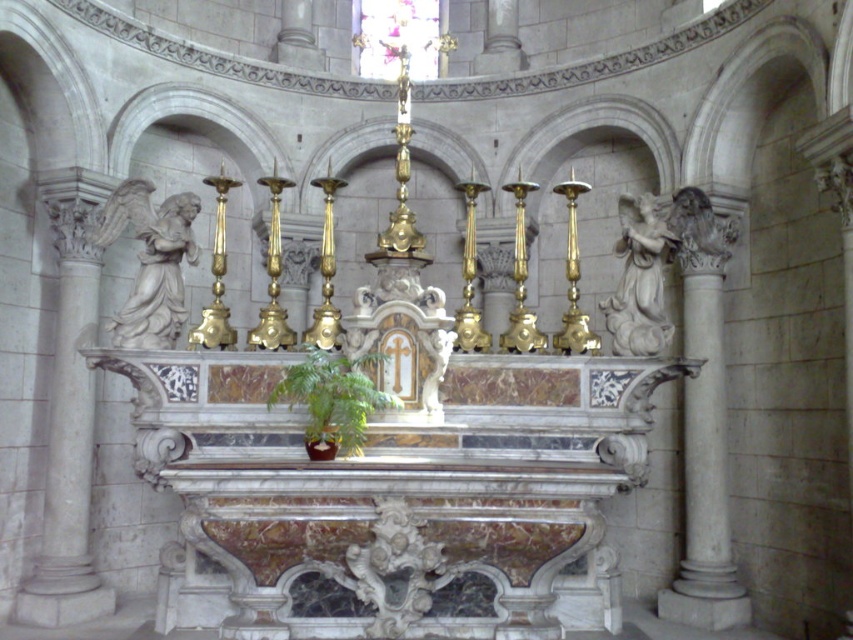
From the picture: You are standing in front of the altar and want to walk towards the white marble column at right and the white marble column at left. Which column should you approach first to reach the closer one?

You should approach the white marble column at right first because it is closer to you than the white marble column at left, which is further away.

You are an architect designing a new cathedral and want to replicate the symmetry of the altar scene. You notice the white marble angel at left and the white marble angel at right. Which angel should you adjust to maintain perfect symmetry in your design?

To maintain perfect symmetry, you should adjust the white marble angel at right to be the same height as the white marble angel at left since the left angel is taller.

You are an architect designing a symmetrical layout for a new chapel. You have two statues, the white marble angel at left and the white marble angel at right. Based on the scene, which angel should be placed on the left side of the central cross to maintain symmetry?

The white marble angel at left should be placed on the left side of the central cross to maintain symmetry, as the original scene shows the white marble angel at left positioned on the left side of the white marble angel at right, indicating their symmetric placement.